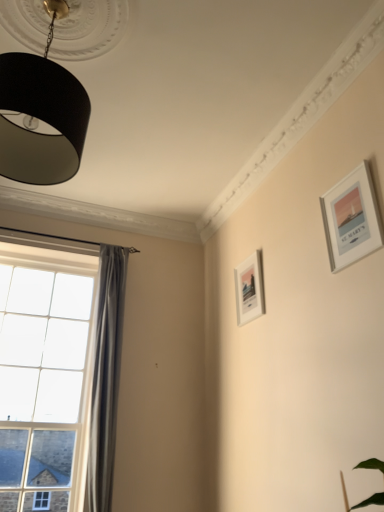
Question: Is satin grey curtain at left in front of or behind silver metallic picture frame at upper right, the first picture frame in the right-to-left sequence, in the image?

Choices:
 (A) front
 (B) behind

Answer: (B)

Question: Based on their positions, is satin grey curtain at left located to the left or right of silver metallic picture frame at upper right, the first picture frame in the right-to-left sequence?

Choices:
 (A) right
 (B) left

Answer: (B)

Question: Considering the real-world distances, which object is farthest from the clear glass window at left?

Choices:
 (A) black matte lampshade at upper left
 (B) satin grey curtain at left
 (C) white matte picture frame at center-right, which ranks as the first picture frame in bottom-to-top order
 (D) silver metallic picture frame at upper right, the 1th picture frame from the top

Answer: (D)

Question: Estimate the real-world distances between objects in this image. Which object is farther from the black matte lampshade at upper left?

Choices:
 (A) silver metallic picture frame at upper right, which ranks as the 2th picture frame in bottom-to-top order
 (B) clear glass window at left
 (C) white matte picture frame at center-right, positioned as the first picture frame in left-to-right order
 (D) satin grey curtain at left

Answer: (D)